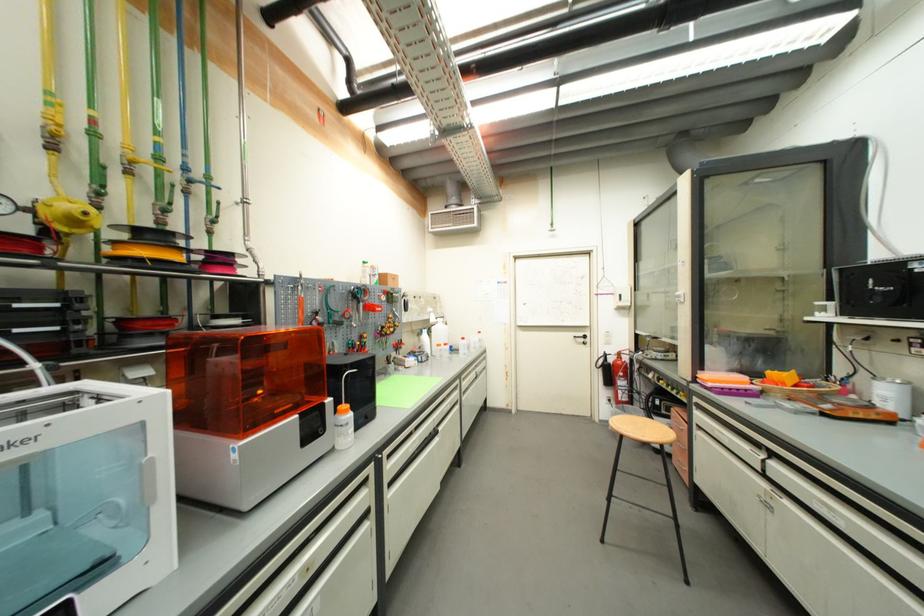
Where would you sit the chair sitting surface? Please return your answer as a coordinate pair (x, y).

(641, 429)